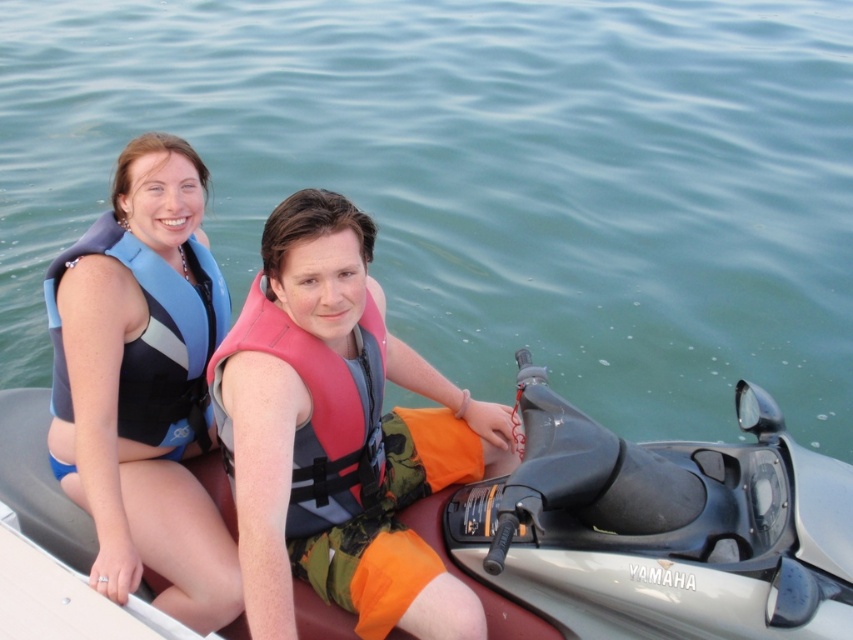
Is matte blue life vest at left below blue neoprene life vest at upper left?

Yes, matte blue life vest at left is below blue neoprene life vest at upper left.

Between matte blue life vest at left and blue neoprene life vest at upper left, which one appears on the right side from the viewer's perspective?

matte blue life vest at left

What do you see at coordinates (339, 435) in the screenshot? I see `matte blue life vest at left` at bounding box center [339, 435].

The image size is (853, 640). Identify the location of matte blue life vest at left. (339, 435).

Is point (486, 234) closer to camera compared to point (450, 577)?

No, it is not.

Is clear blue water at upper center positioned behind matte blue life vest at left?

That is True.

At what (x,y) coordinates should I click in order to perform the action: click on clear blue water at upper center. Please return your answer as a coordinate pair (x, y). Looking at the image, I should click on (486, 180).

How much distance is there between metallic gray jet ski at center and blue neoprene life vest at upper left?

1.06 meters

Does point (685, 492) come closer to viewer compared to point (105, 554)?

Yes, it is.

This screenshot has width=853, height=640. In order to click on metallic gray jet ski at center in this screenshot , I will do `click(653, 532)`.